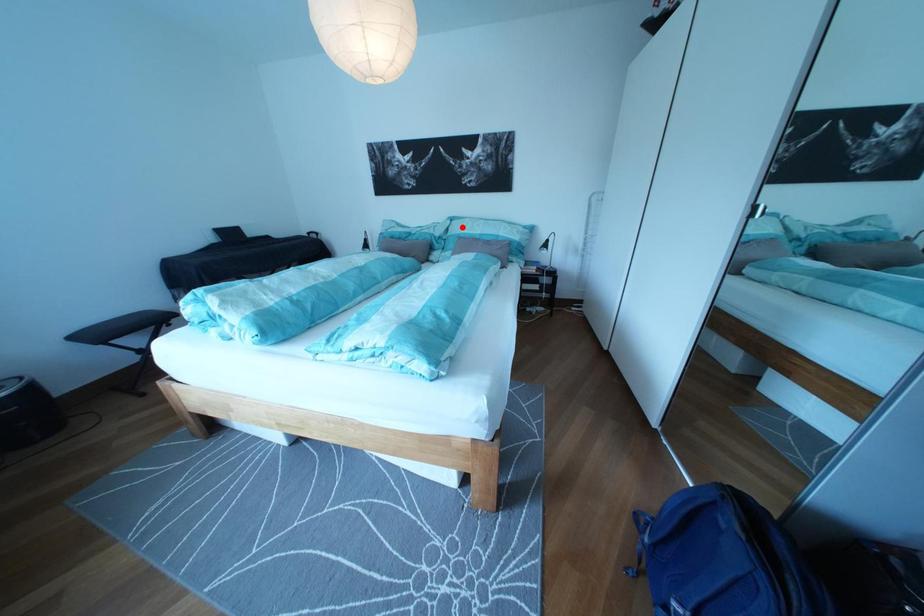
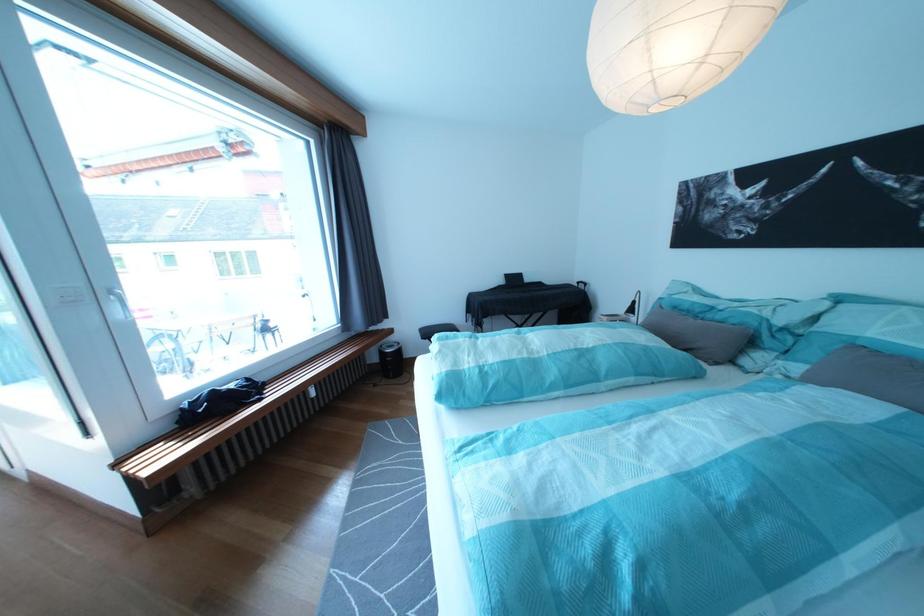
Find the pixel in the second image that matches the highlighted location in the first image.

(841, 309)